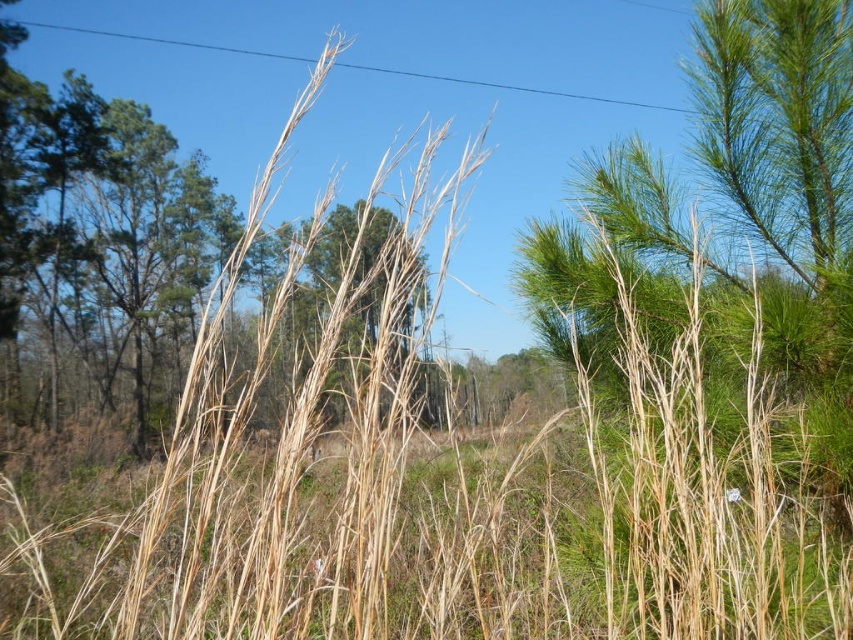
You are standing in the middle of the scene and want to walk towards the dry straw grass at center. Which direction should you move relative to your current position?

Since the dry straw grass at center is located at coordinates approximately 0.863 on the x axis and 0.659 on the y axis, you should move towards the right and slightly forward to reach it.

You are an artist sketching this scene and want to accurately depict the grasses. Which of the two grass types, the dry straw grass at center or the dry grass at center, has a thinner appearance?

The dry straw grass at center has a lesser width compared to dry grass at center, so it has a thinner appearance.

You are standing in the natural outdoor scene looking at the two points marked as point (314, 508) and point (260, 484). Which point is closer to your viewpoint?

Point (260, 484) is closer to your viewpoint because it is less further to the camera than point (314, 508).